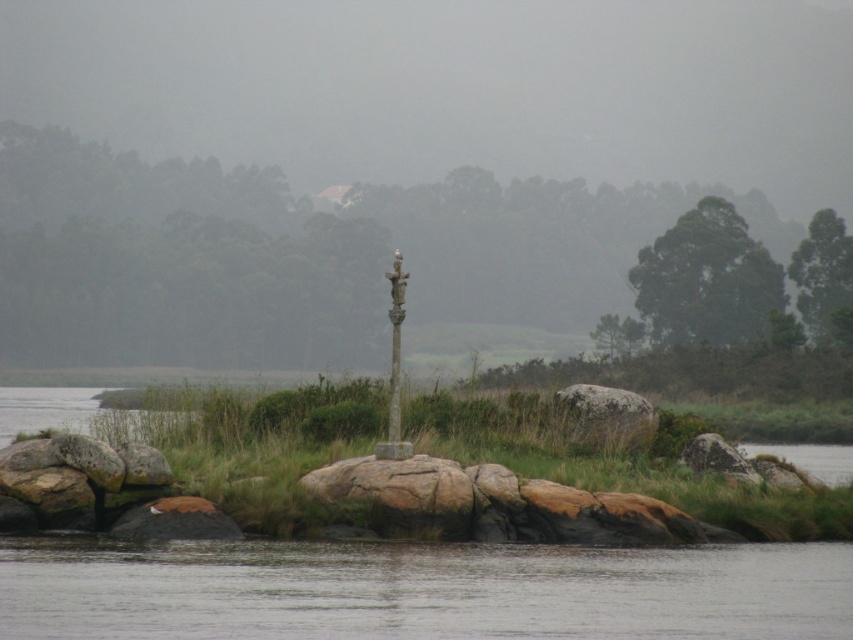
Can you confirm if gray smooth water at lower center is smaller than green leafy tree at upper right?

Correct, gray smooth water at lower center occupies less space than green leafy tree at upper right.

Based on the photo, does gray smooth water at lower center have a greater width compared to green leafy tree at upper right?

Yes, gray smooth water at lower center is wider than green leafy tree at upper right.

Is point (440, 609) closer to camera compared to point (809, 225)?

Yes, point (440, 609) is closer to viewer.

Where is `gray smooth water at lower center`? This screenshot has height=640, width=853. gray smooth water at lower center is located at coordinates (422, 592).

Does rusty rock at center appear on the left side of brown rough rock at center?

Correct, you'll find rusty rock at center to the left of brown rough rock at center.

Does rusty rock at center have a greater width compared to brown rough rock at center?

Yes.

Where is `rusty rock at center`? rusty rock at center is located at coordinates (401, 492).

Is gray smooth water at lower center taller than brown rough rock at center?

No.

Is gray smooth water at lower center smaller than brown rough rock at center?

Incorrect, gray smooth water at lower center is not smaller in size than brown rough rock at center.

The width and height of the screenshot is (853, 640). Describe the element at coordinates (422, 592) in the screenshot. I see `gray smooth water at lower center` at that location.

This screenshot has width=853, height=640. Identify the location of gray smooth water at lower center. [422, 592].